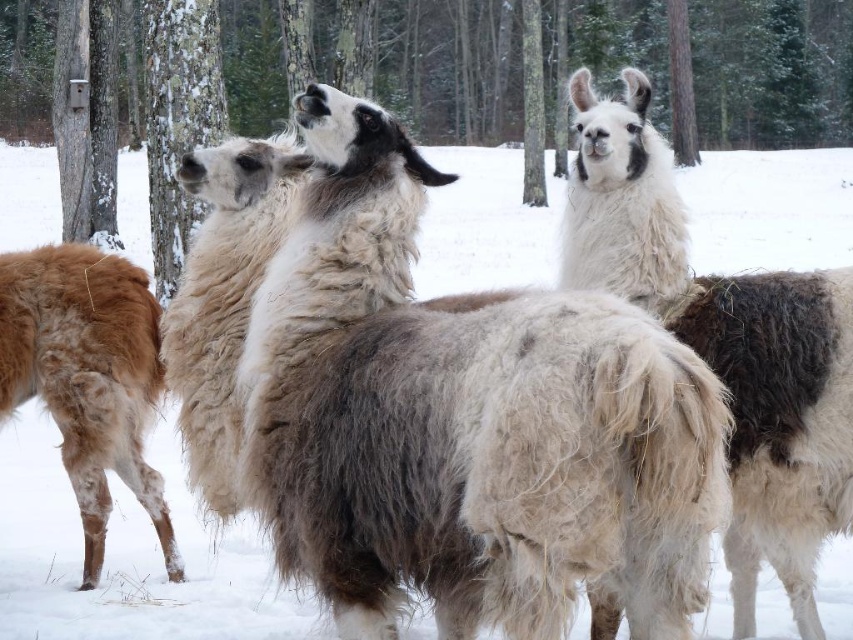
You are standing at the origin point of the coordinate system. You want to move towards the fuzzy white alpaca at center. Which direction should you move in?

You should move towards the point with coordinates 0.659 in the x direction and 0.543 in the y direction to reach the fuzzy white alpaca at center.

You are a photographer trying to capture a group photo of the fuzzy white alpaca at center and the rough bark tree at center. Since you want to include both in the frame, which one should you adjust your camera angle to focus on first to ensure both fit in the photo?

The fuzzy white alpaca at center has a lesser width compared to the rough bark tree at center, so you should focus on the rough bark tree at center first to ensure both fit in the frame.